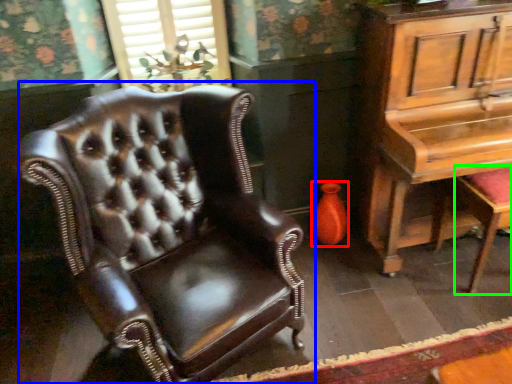
Question: Which object is the closest to the vase (highlighted by a red box)? Choose among these: chair (highlighted by a blue box) or music stool (highlighted by a green box).

Choices:
 (A) chair
 (B) music stool

Answer: (B)